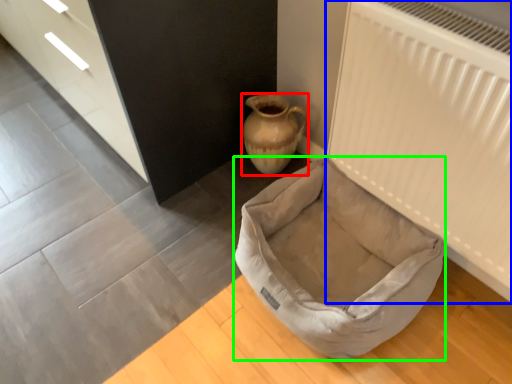
Question: Based on their relative distances, which object is farther from vase (highlighted by a red box)? Choose from radiator (highlighted by a blue box) and dog bed (highlighted by a green box).

Choices:
 (A) radiator
 (B) dog bed

Answer: (A)